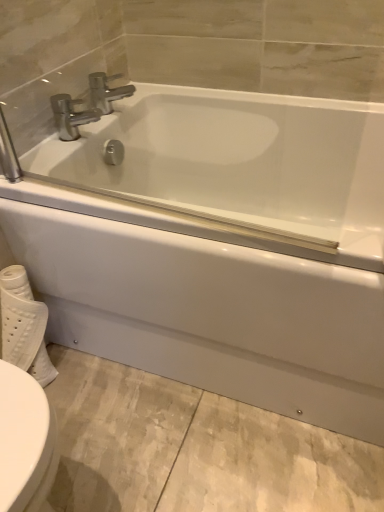
Question: Is polished chrome faucet at upper left, the 1th tap in the bottom-to-top sequence, shorter than white textured toilet paper at lower left?

Choices:
 (A) no
 (B) yes

Answer: (B)

Question: Is polished chrome faucet at upper left, the 1th tap in the bottom-to-top sequence, completely or partially outside of white textured toilet paper at lower left?

Choices:
 (A) yes
 (B) no

Answer: (A)

Question: Can you confirm if polished chrome faucet at upper left, the 1th tap in the bottom-to-top sequence, is taller than white textured toilet paper at lower left?

Choices:
 (A) no
 (B) yes

Answer: (A)

Question: Is polished chrome faucet at upper left, arranged as the 2th tap when viewed from the top, positioned with its back to white textured toilet paper at lower left?

Choices:
 (A) no
 (B) yes

Answer: (A)

Question: From the image's perspective, is polished chrome faucet at upper left, the 1th tap in the bottom-to-top sequence, under white textured toilet paper at lower left?

Choices:
 (A) yes
 (B) no

Answer: (B)

Question: Would you consider polished chrome faucet at upper left, the 1th tap in the bottom-to-top sequence, to be distant from white textured toilet paper at lower left?

Choices:
 (A) no
 (B) yes

Answer: (A)

Question: Does white textured toilet paper at lower left have a greater height compared to polished chrome faucet at upper left, arranged as the 2th tap when viewed from the top?

Choices:
 (A) yes
 (B) no

Answer: (A)

Question: From the image's perspective, is white textured toilet paper at lower left located beneath polished chrome faucet at upper left, arranged as the 2th tap when viewed from the top?

Choices:
 (A) yes
 (B) no

Answer: (A)

Question: Does white textured toilet paper at lower left turn towards polished chrome faucet at upper left, the 1th tap in the bottom-to-top sequence?

Choices:
 (A) no
 (B) yes

Answer: (A)

Question: Is white textured toilet paper at lower left positioned with its back to polished chrome faucet at upper left, the 1th tap in the bottom-to-top sequence?

Choices:
 (A) yes
 (B) no

Answer: (B)

Question: Would you say white textured toilet paper at lower left is outside polished chrome faucet at upper left, arranged as the 2th tap when viewed from the top?

Choices:
 (A) no
 (B) yes

Answer: (B)

Question: Is white textured toilet paper at lower left behind polished chrome faucet at upper left, the 1th tap in the bottom-to-top sequence?

Choices:
 (A) yes
 (B) no

Answer: (B)

Question: From the image's perspective, is polished chrome faucet at upper center, placed as the second tap when sorted from bottom to top, above white textured toilet paper at lower left?

Choices:
 (A) no
 (B) yes

Answer: (B)